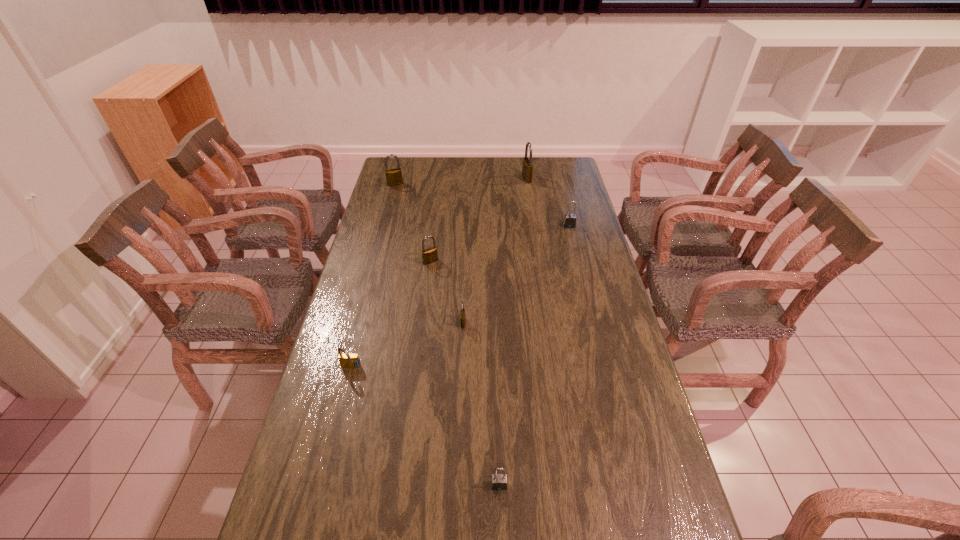
The image size is (960, 540). In order to click on free point between the second nearest padlock and the rightmost padlock in this screenshot , I will do `click(460, 297)`.

Select which object is the second closest to the fifth farthest object. Please provide its 2D coordinates. Your answer should be formatted as a tuple, i.e. [(x, y)], where the tuple contains the x and y coordinates of a point satisfying the conditions above.

[(347, 360)]

Choose which object is the fourth nearest neighbor to the fourth nearest padlock. Please provide its 2D coordinates. Your answer should be formatted as a tuple, i.e. [(x, y)], where the tuple contains the x and y coordinates of a point satisfying the conditions above.

[(569, 221)]

Locate an element on the screen. The height and width of the screenshot is (540, 960). the sixth closest padlock to the third farthest padlock is located at coordinates (498, 481).

Select which padlock appears as the third closest to the second nearest padlock. Please provide its 2D coordinates. Your answer should be formatted as a tuple, i.e. [(x, y)], where the tuple contains the x and y coordinates of a point satisfying the conditions above.

[(498, 481)]

Select which brass padlock appears as the second closest to the fifth nearest padlock. Please provide its 2D coordinates. Your answer should be formatted as a tuple, i.e. [(x, y)], where the tuple contains the x and y coordinates of a point satisfying the conditions above.

[(430, 255)]

Identify which brass padlock is the fourth closest to the smaller gray padlock. Please provide its 2D coordinates. Your answer should be formatted as a tuple, i.e. [(x, y)], where the tuple contains the x and y coordinates of a point satisfying the conditions above.

[(393, 176)]

This screenshot has height=540, width=960. I want to click on free point that satisfies the following two spatial constraints: 1. on the front side of the fourth object from left to right; 2. on the right side of the third object from left to right, so click(x=422, y=323).